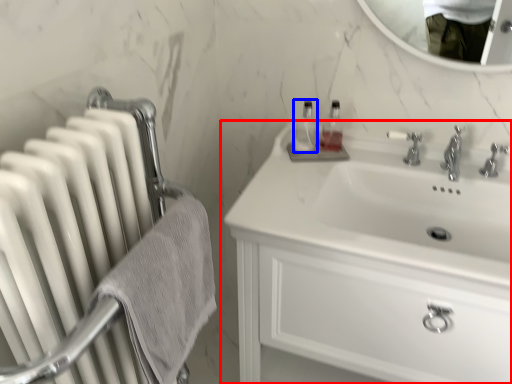
Question: Which point is closer to the camera, bathroom cabinet (highlighted by a red box) or bottle (highlighted by a blue box)?

Choices:
 (A) bathroom cabinet
 (B) bottle

Answer: (A)